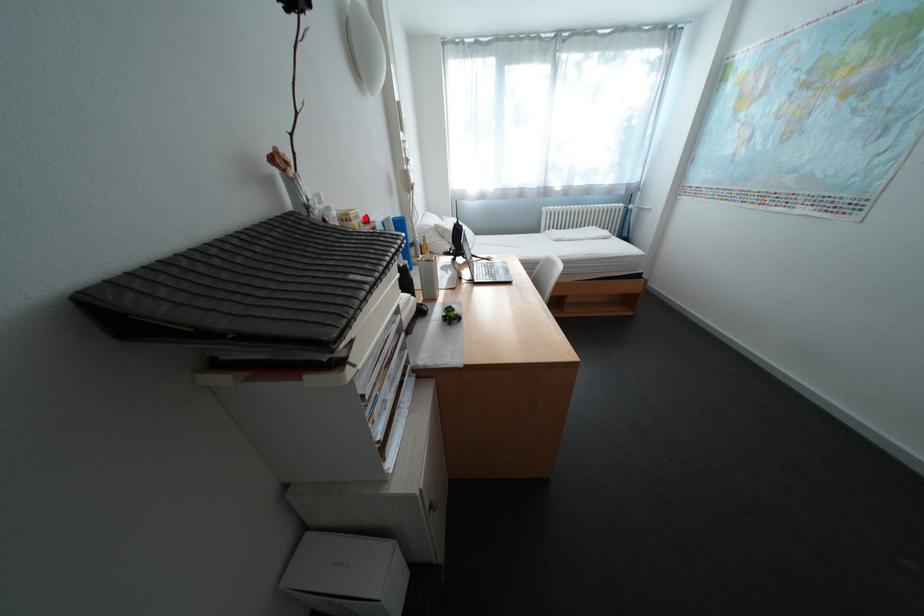
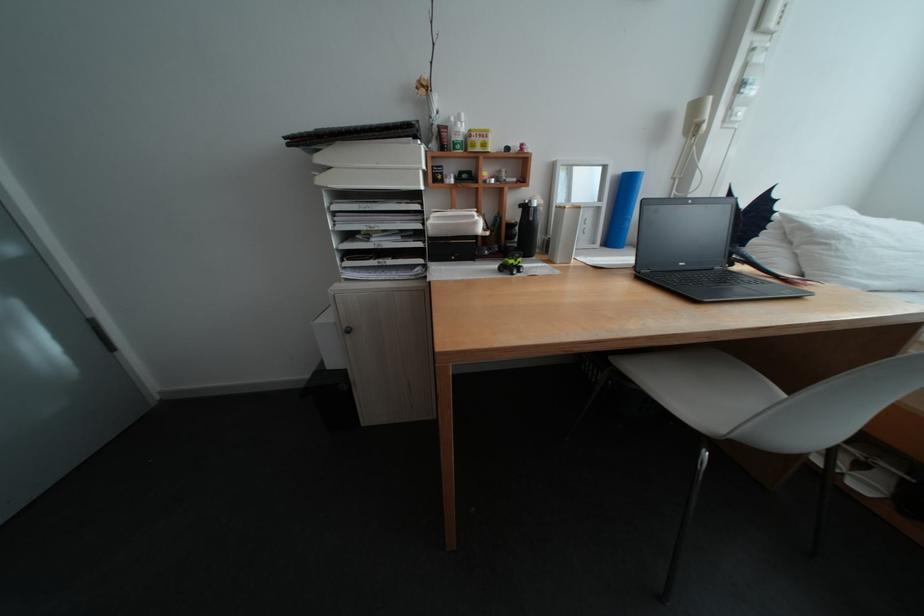
Find the pixel in the second image that matches the highlighted location in the first image.

(485, 135)